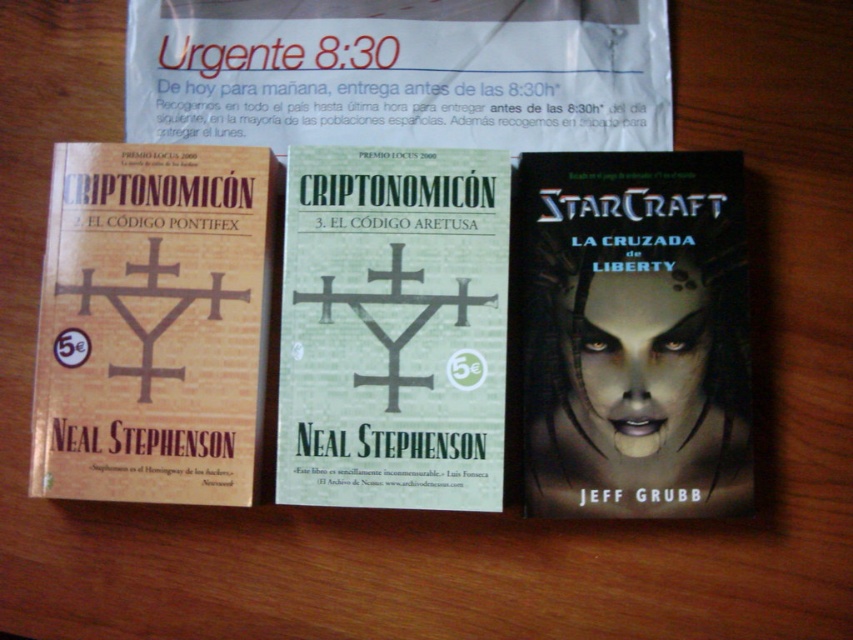
Question: Does dark matte cover at center appear on the right side of matte paper book at left?

Choices:
 (A) no
 (B) yes

Answer: (B)

Question: Is green matte book at center further to the viewer compared to matte paper book at left?

Choices:
 (A) no
 (B) yes

Answer: (B)

Question: In this image, where is green matte book at center located relative to matte paper book at left?

Choices:
 (A) right
 (B) left

Answer: (A)

Question: Which of the following is the farthest from the observer?

Choices:
 (A) green matte book at center
 (B) matte paper book at left
 (C) dark matte cover at center

Answer: (A)

Question: Which point appears farthest from the camera in this image?

Choices:
 (A) (367, 470)
 (B) (631, 392)

Answer: (B)

Question: Which object is positioned farthest from the matte paper book at left?

Choices:
 (A) matte paper flyer at center
 (B) green matte book at center

Answer: (A)